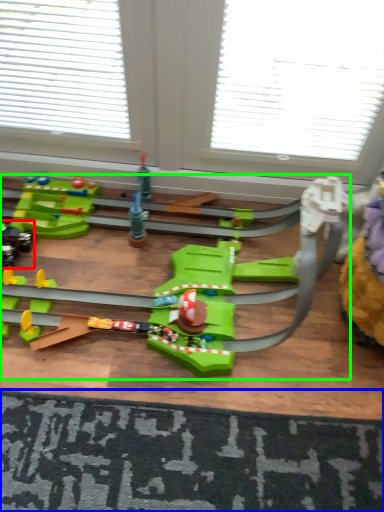
Question: Based on their relative distances, which object is nearer to toy (highlighted by a red box)? Choose from doormat (highlighted by a blue box) and toy (highlighted by a green box).

Choices:
 (A) doormat
 (B) toy

Answer: (B)